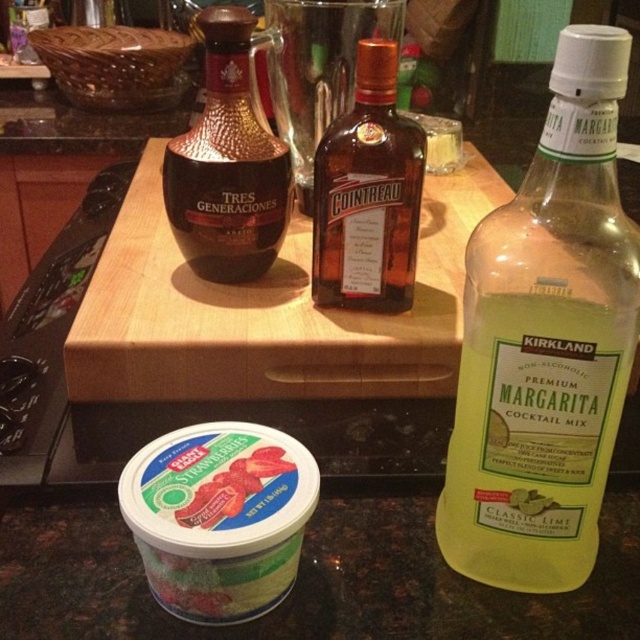
Question: Among these objects, which one is farthest from the camera?

Choices:
 (A) green translucent bottle at right
 (B) green matte yogurt at lower left
 (C) shiny brown glass bottle at center-left

Answer: (C)

Question: Does green translucent bottle at right have a larger size compared to shiny brown glass bottle at center-left?

Choices:
 (A) yes
 (B) no

Answer: (A)

Question: Which point appears closest to the camera in this image?

Choices:
 (A) (256, 157)
 (B) (506, 566)
 (C) (243, 509)
 (D) (364, 67)

Answer: (C)

Question: Can you confirm if green translucent bottle at right is smaller than green matte yogurt at lower left?

Choices:
 (A) no
 (B) yes

Answer: (A)

Question: Which point is farther to the camera?

Choices:
 (A) (406, 308)
 (B) (202, 512)
 (C) (216, 106)
 (D) (509, 506)

Answer: (A)

Question: Is shiny brown glass bottle at center-left above green matte yogurt at lower left?

Choices:
 (A) yes
 (B) no

Answer: (A)